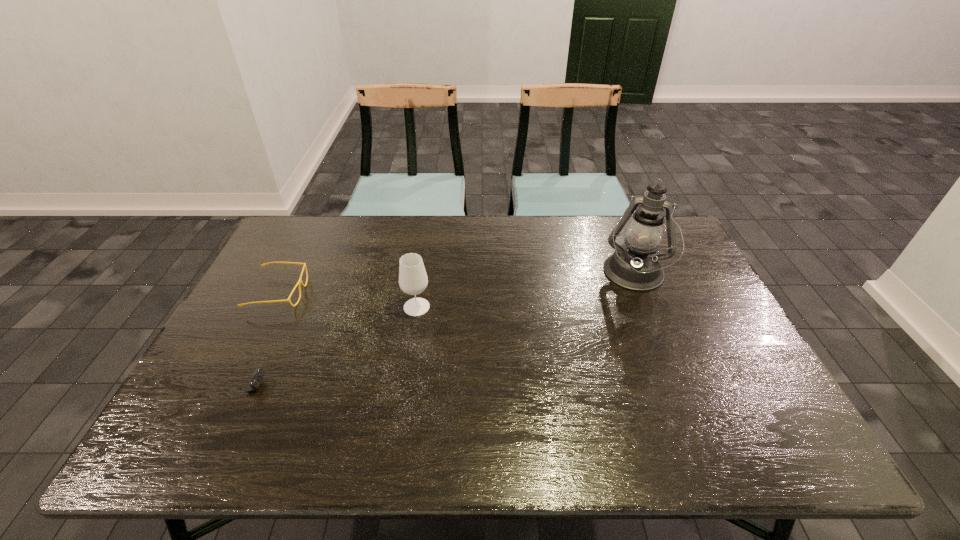
Identify the location of free space between the rightmost object and the glass. [525, 291].

Where is `free space that is in between the shortest object and the spectacles`? This screenshot has height=540, width=960. free space that is in between the shortest object and the spectacles is located at coordinates (253, 340).

I want to click on free point between the shortest object and the glass, so click(323, 347).

At what (x,y) coordinates should I click in order to perform the action: click on vacant space in between the second shortest object and the webcam. Please return your answer as a coordinate pair (x, y). Image resolution: width=960 pixels, height=540 pixels. Looking at the image, I should click on (253, 340).

Locate an element on the screen. This screenshot has width=960, height=540. free space that is in between the third object from left to right and the spectacles is located at coordinates (348, 300).

The image size is (960, 540). In order to click on vacant point located between the rightmost object and the glass in this screenshot , I will do `click(525, 291)`.

Image resolution: width=960 pixels, height=540 pixels. I want to click on empty space between the tallest object and the third object from left to right, so click(525, 291).

Find the location of a particular element. This screenshot has height=540, width=960. vacant space in between the third tallest object and the tallest object is located at coordinates (456, 284).

Image resolution: width=960 pixels, height=540 pixels. I want to click on free space between the glass and the spectacles, so click(x=348, y=300).

Identify the location of empty location between the webcam and the third tallest object. (253, 340).